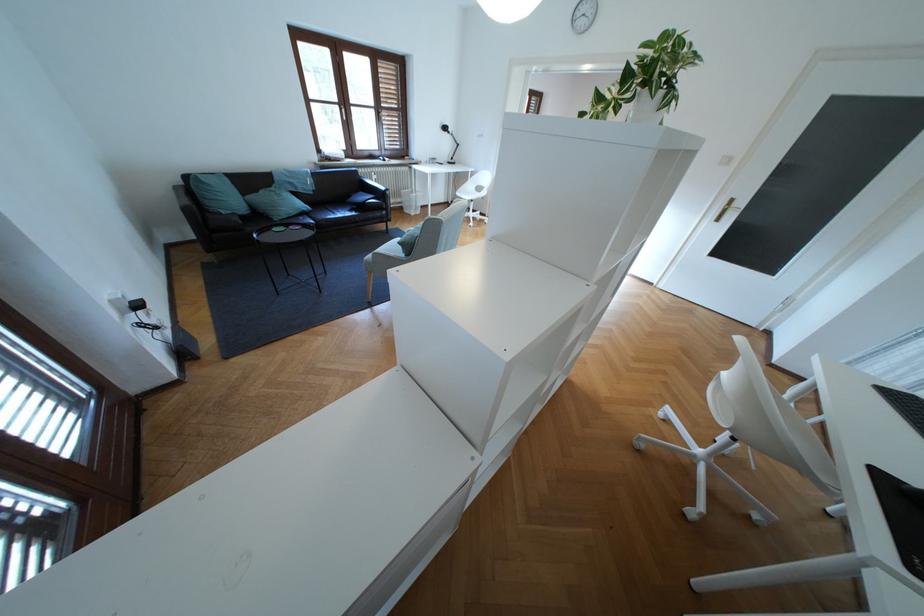
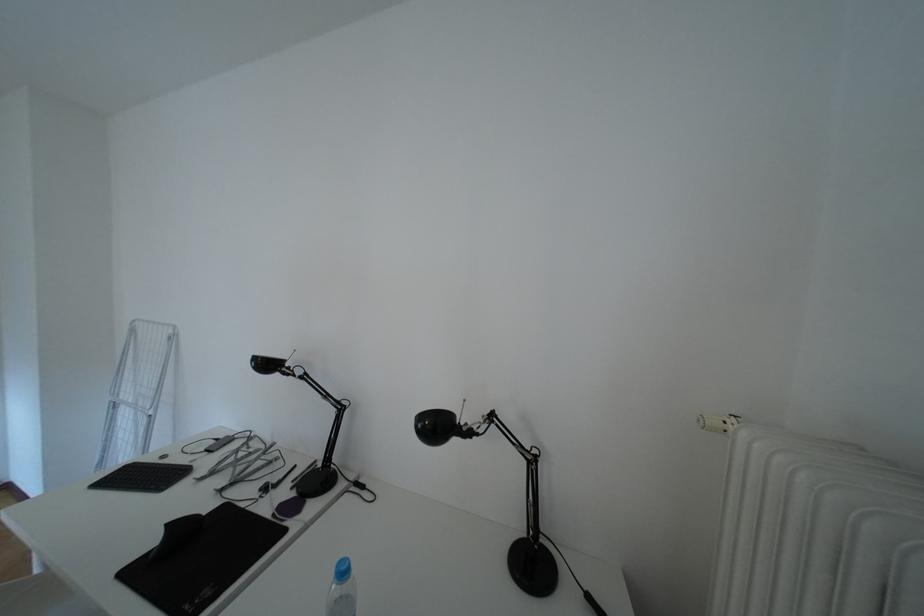
How did the camera likely rotate?

The rotation direction of the camera is right-down.